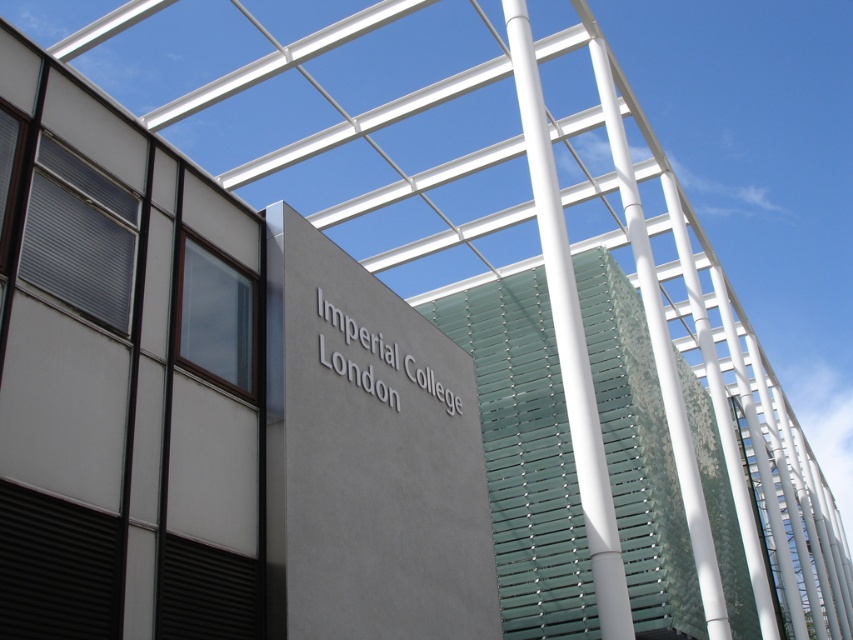
Question: Which of the following is the farthest from the observer?

Choices:
 (A) matte gray shutter at upper left
 (B) brown matte shutter at upper left
 (C) black matte shutter at lower left
 (D) gray concrete sign at center

Answer: (B)

Question: Which point is closer to the camera?

Choices:
 (A) (227, 324)
 (B) (648, 520)

Answer: (A)

Question: Is gray concrete sign at center positioned in front of brown matte shutter at upper left?

Choices:
 (A) no
 (B) yes

Answer: (B)

Question: Can you confirm if gray concrete sign at center is positioned above black matte shutter at lower left?

Choices:
 (A) no
 (B) yes

Answer: (A)

Question: Which point appears farthest from the camera in this image?

Choices:
 (A) (45, 627)
 (B) (570, 634)
 (C) (322, 301)

Answer: (B)

Question: Is matte gray shutter at upper left to the left of brown matte shutter at upper left from the viewer's perspective?

Choices:
 (A) no
 (B) yes

Answer: (B)